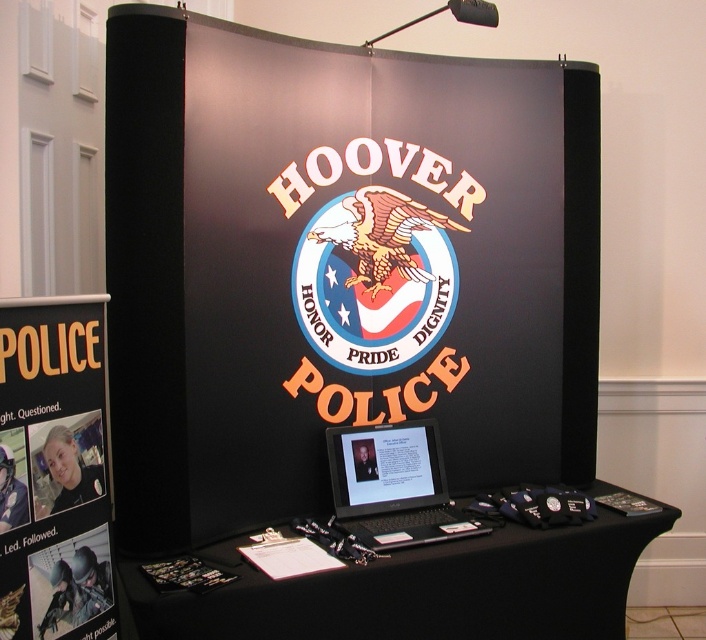
Is black fabric table at lower center taller than black paper poster at left?

No.

Is point (443, 596) closer to camera compared to point (80, 556)?

No, it is behind (80, 556).

Is point (454, 564) farther from camera compared to point (80, 296)?

Yes, point (454, 564) is farther from viewer.

Locate an element on the screen. The image size is (706, 640). black fabric table at lower center is located at coordinates (418, 589).

Consider the image. Which is more to the left, black matte board at center or black plastic laptop at center?

Positioned to the left is black matte board at center.

Looking at this image, is black matte board at center wider than black plastic laptop at center?

Indeed, black matte board at center has a greater width compared to black plastic laptop at center.

Who is more distant from viewer, (138,324) or (345,438)?

The point (345,438) is behind.

Where is `black matte board at center`? This screenshot has width=706, height=640. black matte board at center is located at coordinates (337, 266).

Between point (8, 410) and point (388, 436), which one is positioned behind?

Point (388, 436)

Which is behind, point (66, 532) or point (335, 433)?

Positioned behind is point (335, 433).

At what (x,y) coordinates should I click in order to perform the action: click on black paper poster at left. Please return your answer as a coordinate pair (x, y). Image resolution: width=706 pixels, height=640 pixels. Looking at the image, I should click on (53, 470).